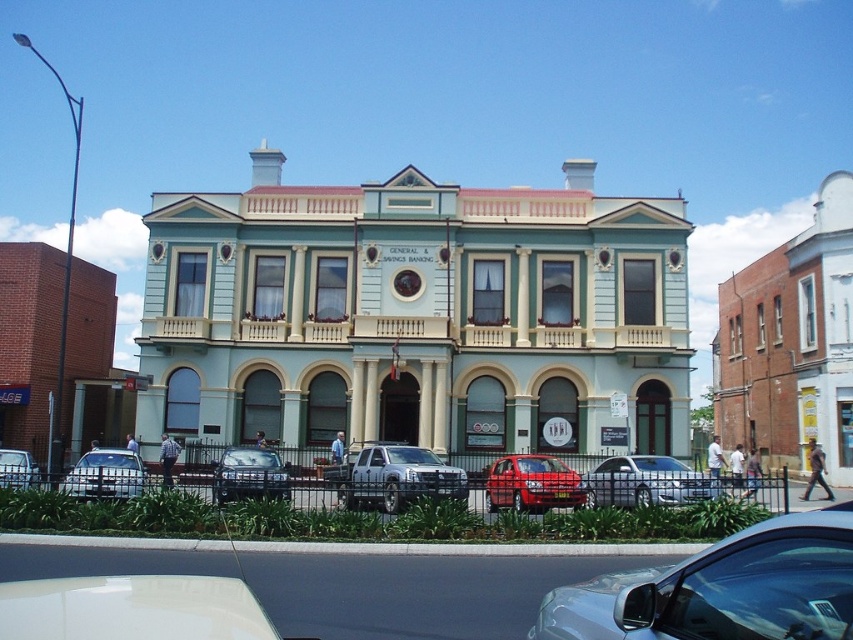
Between point (630, 472) and point (33, 477), which one is positioned behind?

Positioned behind is point (630, 472).

Is point (637, 477) positioned in front of point (3, 476)?

That is False.

Describe the element at coordinates (645, 483) in the screenshot. I see `silver metallic sedan at center` at that location.

Identify the location of silver metallic sedan at center. (645, 483).

Who is higher up, metallic teal car at lower right or silver metallic sedan at lower left?

silver metallic sedan at lower left

Measure the distance from metallic teal car at lower right to silver metallic sedan at lower left.

The distance of metallic teal car at lower right from silver metallic sedan at lower left is 36.91 meters.

Find the location of a particular element. Image resolution: width=853 pixels, height=640 pixels. metallic teal car at lower right is located at coordinates (722, 588).

Is shiny red sedan at center further to the viewer compared to matte silver sedan at lower left?

No, it is in front of matte silver sedan at lower left.

Is point (486, 483) positioned behind point (20, 454)?

That is False.

At what (x,y) coordinates should I click in order to perform the action: click on shiny red sedan at center. Please return your answer as a coordinate pair (x, y). Looking at the image, I should click on (532, 483).